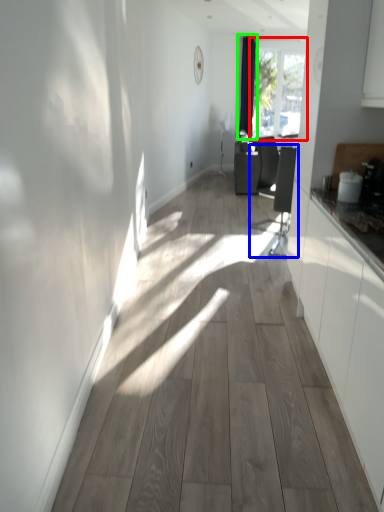
Question: Considering the real-world distances, which object is closest to window (highlighted by a red box)? swivel chair (highlighted by a blue box) or curtain (highlighted by a green box).

Choices:
 (A) swivel chair
 (B) curtain

Answer: (B)